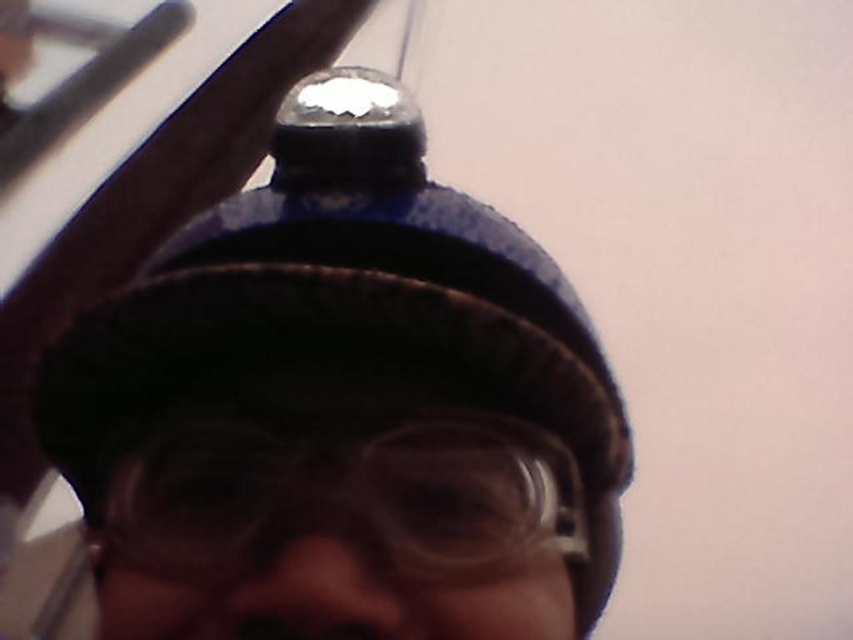
Describe the element at coordinates (347, 330) in the screenshot. The width and height of the screenshot is (853, 640). I see `blue fabric cap at center` at that location.

In the scene shown: Can you confirm if blue fabric cap at center is thinner than transparent plastic goggles at center?

No.

Is point (334, 260) farther from viewer compared to point (160, 515)?

Yes, point (334, 260) is farther from viewer.

Locate an element on the screen. Image resolution: width=853 pixels, height=640 pixels. blue fabric cap at center is located at coordinates (347, 330).